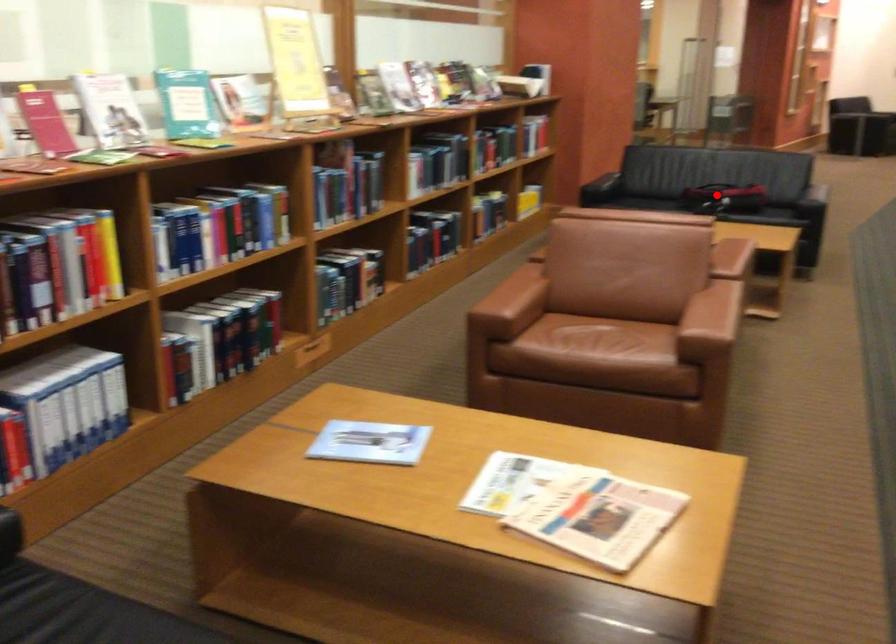
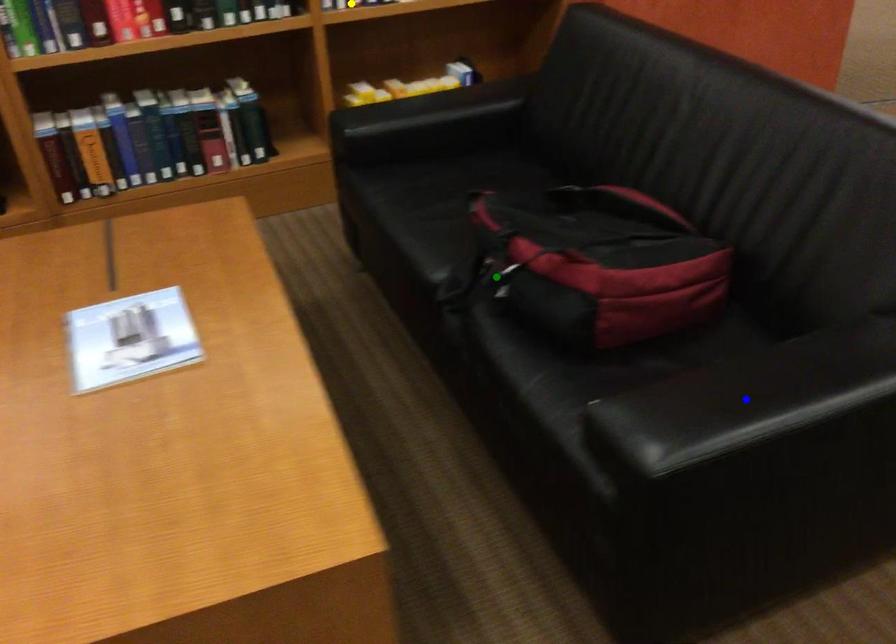
Question: I am providing you with two images of the same scene from different viewpoints. A red point is marked on the first image. You are given multiple points on the second image. Which spot in image 2 lines up with the point in image 1?

Choices:
 (A) yellow point
 (B) green point
 (C) blue point

Answer: (B)